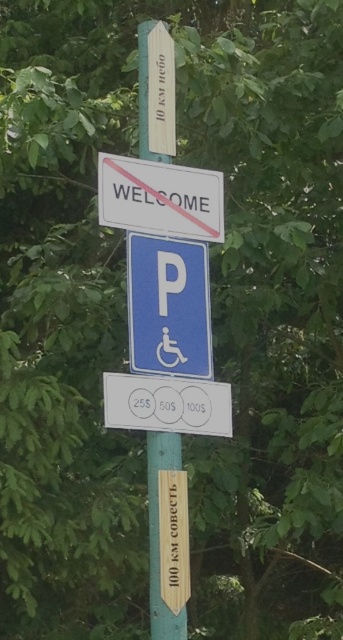
Between blue plastic parking sign at center and green wooden pole at center, which one is positioned higher?

green wooden pole at center is higher up.

Is blue plastic parking sign at center thinner than green wooden pole at center?

No.

Does point (166, 289) come in front of point (144, 40)?

That is True.

This screenshot has height=640, width=343. Identify the location of blue plastic parking sign at center. (169, 307).

Is white plastic sign at upper center shorter than green wooden pole at center?

Yes.

Does white plastic sign at upper center have a lesser width compared to green wooden pole at center?

In fact, white plastic sign at upper center might be wider than green wooden pole at center.

Is point (179, 208) farther from camera compared to point (147, 38)?

No, it is in front of (147, 38).

The width and height of the screenshot is (343, 640). Identify the location of white plastic sign at upper center. (159, 196).

Can you confirm if blue plastic parking sign at center is shorter than white plastic sign at upper center?

Incorrect, blue plastic parking sign at center's height does not fall short of white plastic sign at upper center's.

Is point (148, 268) positioned after point (190, 186)?

No, (148, 268) is in front of (190, 186).

Where is `blue plastic parking sign at center`? This screenshot has height=640, width=343. blue plastic parking sign at center is located at coordinates 169,307.